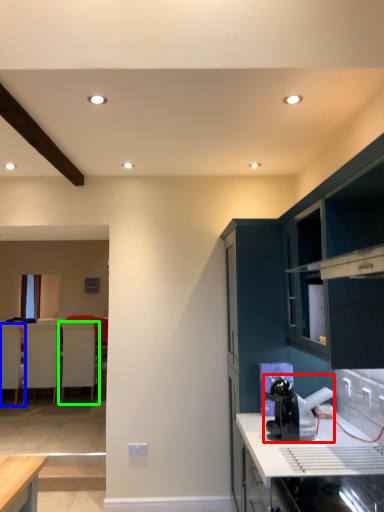
Question: Which object is positioned farthest from appliance (highlighted by a red box)? Select from armchair (highlighted by a blue box) and armchair (highlighted by a green box).

Choices:
 (A) armchair
 (B) armchair

Answer: (A)